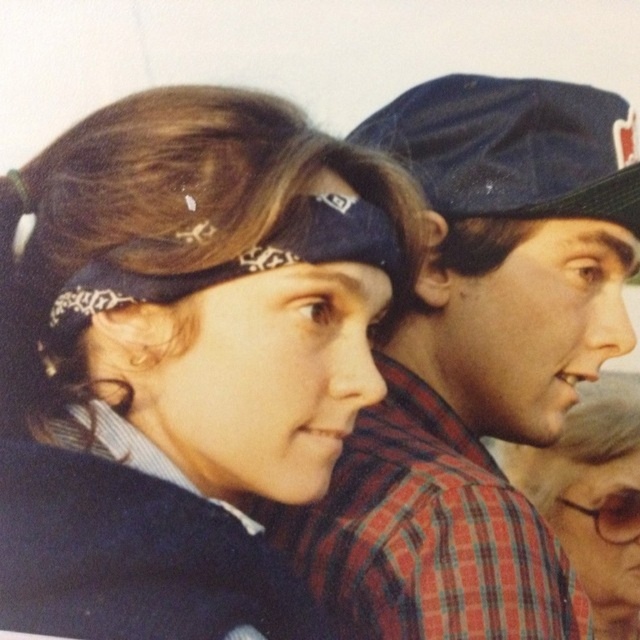
You are standing in front of the two people in the image. The point marked at coordinates (513, 147) indicates a specific location. What object is located at that point?

The point at coordinates (513, 147) marks the blue fabric baseball cap at upper right.

Based on the scene description, which object is positioned lower in the image between the matte black bandana at center and the blue fabric baseball cap at upper right?

The matte black bandana at center is positioned below the blue fabric baseball cap at upper right.

You are a photographer trying to take a portrait of both individuals in the scene. You notice two black accessories in the frame. Which matte black accessory is positioned lower between the matte black bandana at center and the matte black headband at upper center?

The matte black bandana at center is positioned lower than the matte black headband at upper center because it is not as tall as the headband.